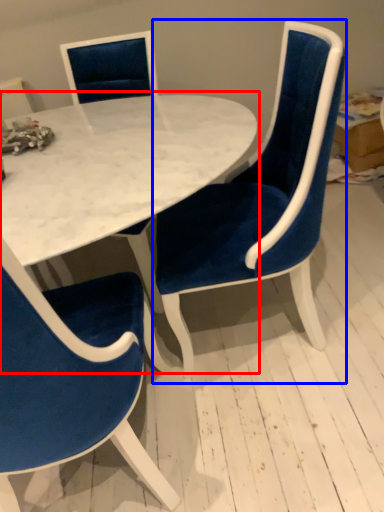
Question: Which point is closer to the camera, table (highlighted by a red box) or chair (highlighted by a blue box)?

Choices:
 (A) table
 (B) chair

Answer: (B)